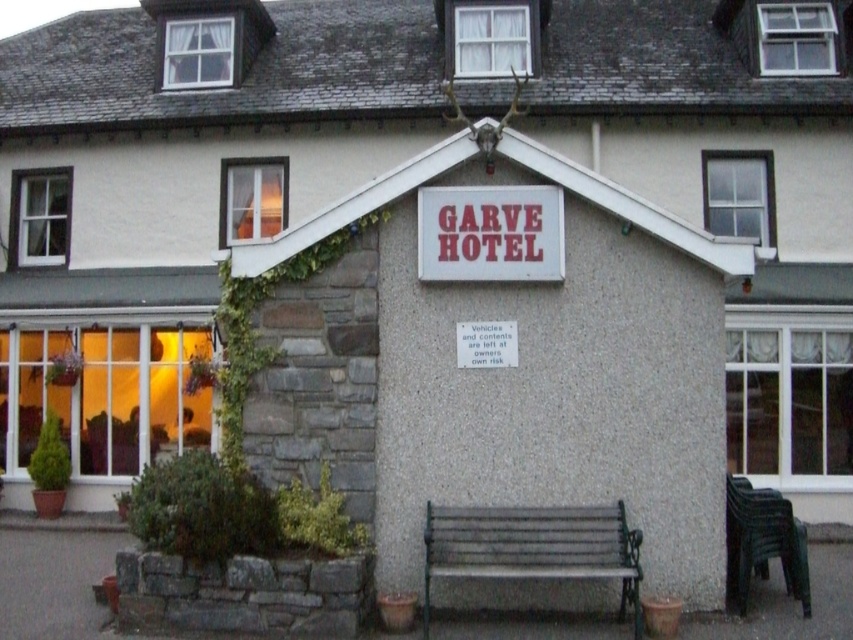
Question: Estimate the real-world distances between objects in this image. Which object is farther from the black plastic bench at lower right?

Choices:
 (A) red plastic sign at center
 (B) green metal bench at lower center

Answer: (A)

Question: In this image, where is red plastic sign at center located relative to black plastic bench at lower right?

Choices:
 (A) below
 (B) above

Answer: (B)

Question: In this image, where is green metal bench at lower center located relative to red plastic sign at center?

Choices:
 (A) left
 (B) right

Answer: (B)

Question: Considering the relative positions of green metal bench at lower center and red plastic sign at center in the image provided, where is green metal bench at lower center located with respect to red plastic sign at center?

Choices:
 (A) above
 (B) below

Answer: (B)

Question: Which point is farther to the camera?

Choices:
 (A) black plastic bench at lower right
 (B) green metal bench at lower center

Answer: (A)

Question: Which object appears farthest from the camera in this image?

Choices:
 (A) green metal bench at lower center
 (B) black plastic bench at lower right

Answer: (B)